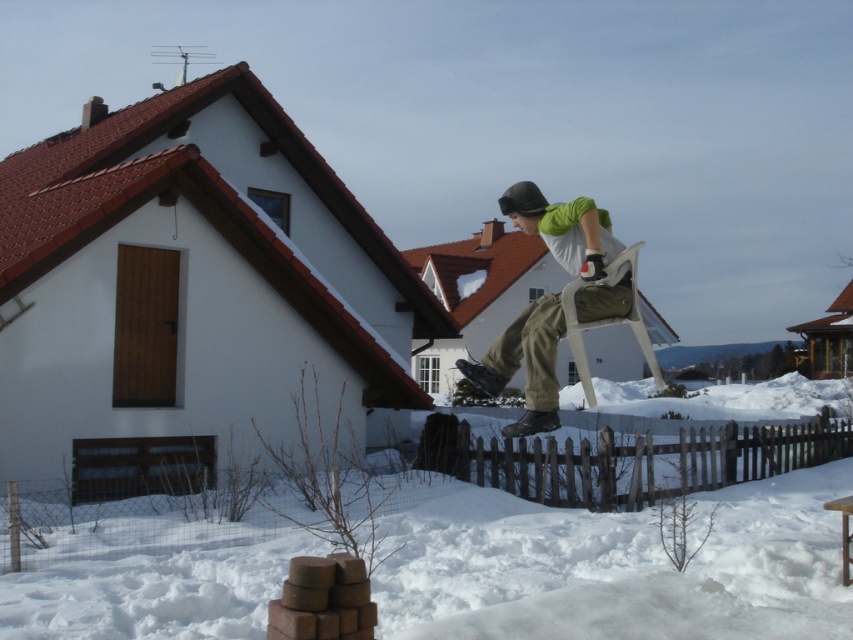
Question: Can you confirm if brown wooden fence at lower center is bigger than matte green shirt at center?

Choices:
 (A) yes
 (B) no

Answer: (B)

Question: Among these objects, which one is nearest to the camera?

Choices:
 (A) matte green shirt at center
 (B) brown wooden fence at lower center

Answer: (A)

Question: In this image, where is brown wooden fence at lower center located relative to matte green shirt at center?

Choices:
 (A) above
 (B) below

Answer: (B)

Question: Does brown wooden fence at lower center appear over matte green shirt at center?

Choices:
 (A) yes
 (B) no

Answer: (B)

Question: Which point is closer to the camera?

Choices:
 (A) matte green shirt at center
 (B) brown wooden fence at lower center

Answer: (A)